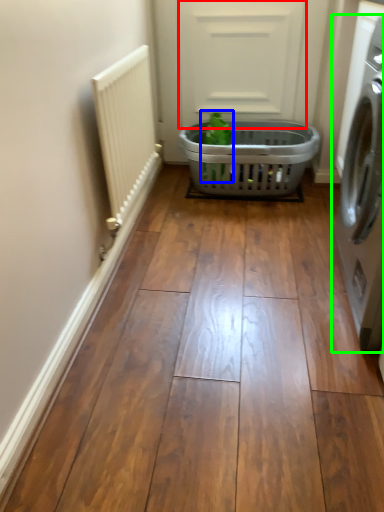
Question: Which object is positioned closest to screen door (highlighted by a red box)? Select from plant (highlighted by a blue box) and washing machine (highlighted by a green box).

Choices:
 (A) plant
 (B) washing machine

Answer: (A)